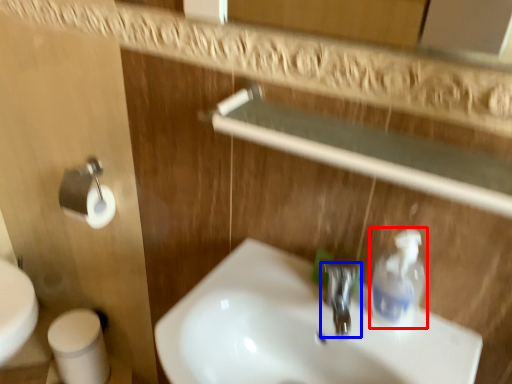
Question: Which object is closer to the camera taking this photo, cleaning product (highlighted by a red box) or tap (highlighted by a blue box)?

Choices:
 (A) cleaning product
 (B) tap

Answer: (A)